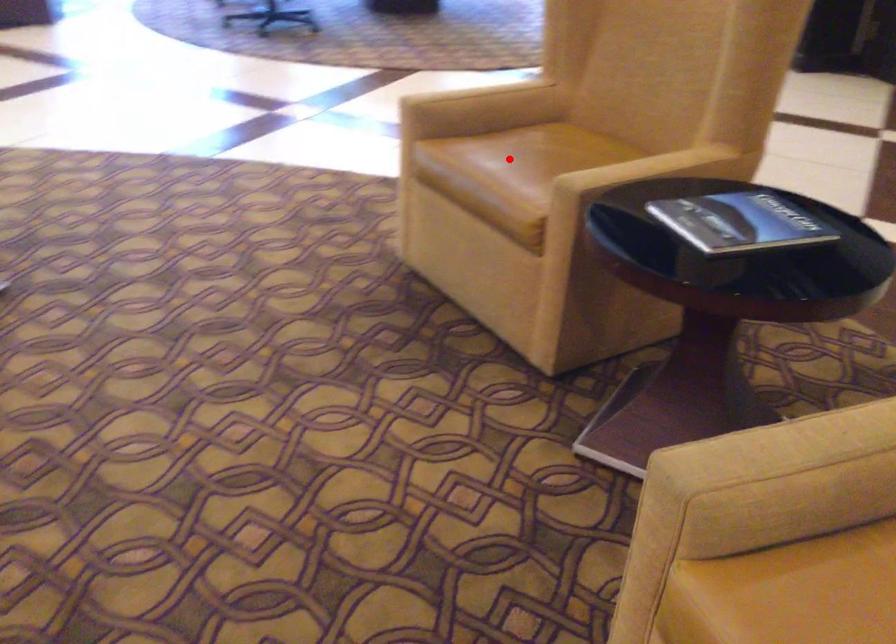
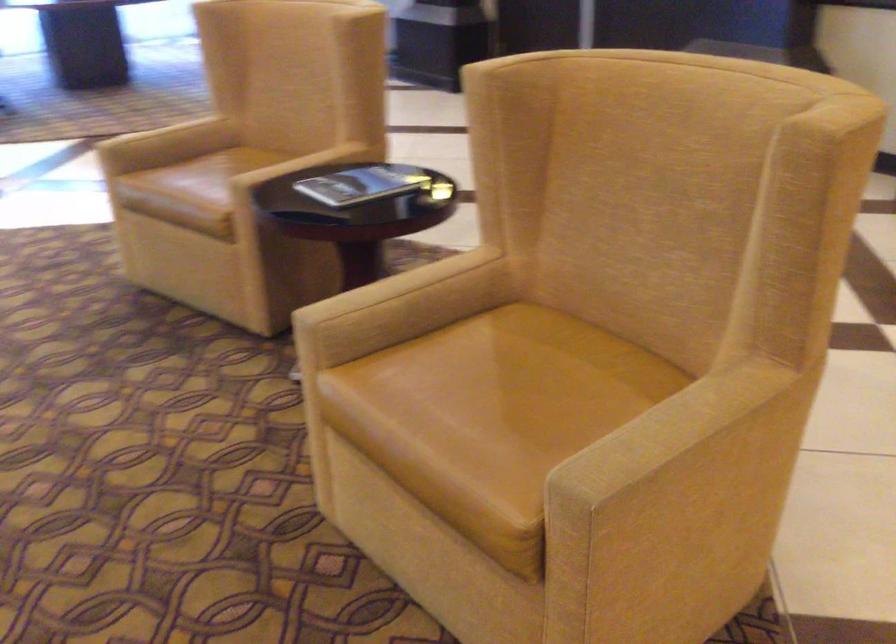
Question: I am providing you with two images of the same scene from different viewpoints. Image1 has a red point marked. In image2, the corresponding 3D location appears at what relative position? Reply with the corresponding letter.

Choices:
 (A) Closer
 (B) Farther

Answer: (B)